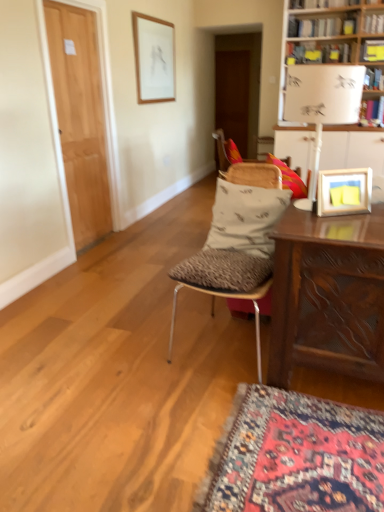
Question: From a real-world perspective, is white fabric-covered chair at center, the 1th chair when ordered from back to front, on top of wooden picture frame at upper right, which is the 1th picture frame from right to left?

Choices:
 (A) no
 (B) yes

Answer: (A)

Question: Is white fabric-covered chair at center, positioned as the second chair in front-to-back order, further to camera compared to wooden picture frame at upper right, the 1th picture frame positioned from the front?

Choices:
 (A) yes
 (B) no

Answer: (A)

Question: Considering the relative positions of white fabric-covered chair at center, positioned as the second chair in front-to-back order, and wooden picture frame at upper right, arranged as the 2th picture frame when viewed from the back, in the image provided, is white fabric-covered chair at center, positioned as the second chair in front-to-back order, to the right of wooden picture frame at upper right, arranged as the 2th picture frame when viewed from the back, from the viewer's perspective?

Choices:
 (A) no
 (B) yes

Answer: (A)

Question: Is white fabric-covered chair at center, the 1th chair when ordered from back to front, not near wooden picture frame at upper right, which is the 1th picture frame from right to left?

Choices:
 (A) yes
 (B) no

Answer: (A)

Question: Could you tell me if white fabric-covered chair at center, the 1th chair when ordered from back to front, is facing wooden picture frame at upper right, acting as the 2th picture frame starting from the top?

Choices:
 (A) no
 (B) yes

Answer: (A)

Question: Can you confirm if white fabric-covered chair at center, the 1th chair when ordered from back to front, is shorter than wooden picture frame at upper right, arranged as the 2th picture frame when viewed from the back?

Choices:
 (A) no
 (B) yes

Answer: (A)

Question: Is light brown wood door at left, the 1th door viewed from the front, outside white paper lampshade at upper right?

Choices:
 (A) no
 (B) yes

Answer: (B)

Question: Does light brown wood door at left, marked as the 2th door in a right-to-left arrangement, appear on the left side of white paper lampshade at upper right?

Choices:
 (A) yes
 (B) no

Answer: (A)

Question: Is white paper lampshade at upper right located within light brown wood door at left, the second door positioned from the top?

Choices:
 (A) yes
 (B) no

Answer: (B)

Question: From a real-world perspective, is light brown wood door at left, the second door positioned from the top, positioned under white paper lampshade at upper right based on gravity?

Choices:
 (A) no
 (B) yes

Answer: (B)

Question: Is light brown wood door at left, the 1th door viewed from the front, aimed at white paper lampshade at upper right?

Choices:
 (A) yes
 (B) no

Answer: (B)

Question: Does light brown wood door at left, the 1th door in the bottom-to-top sequence, come in front of white paper lampshade at upper right?

Choices:
 (A) yes
 (B) no

Answer: (B)

Question: From a real-world perspective, is wooden picture frame at upper right, acting as the 2th picture frame starting from the top, physically above hardcover book at upper center, which ranks as the 2th book in bottom-to-top order?

Choices:
 (A) yes
 (B) no

Answer: (B)